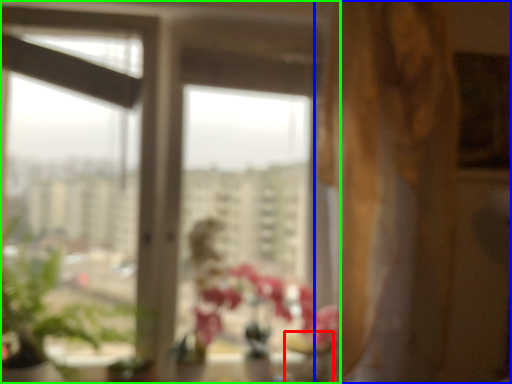
Question: Considering the real-world distances, which object is closest to glass vase (highlighted by a red box)? curtain (highlighted by a blue box) or window (highlighted by a green box).

Choices:
 (A) curtain
 (B) window

Answer: (A)